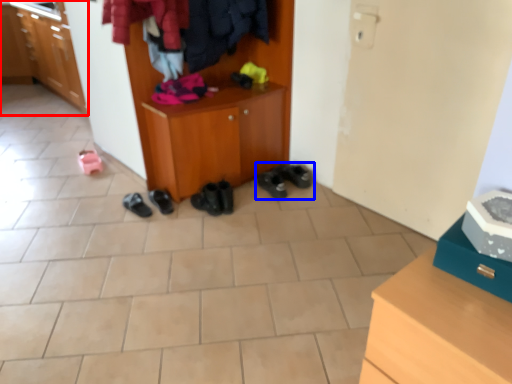
Question: Which object appears farthest to the camera in this image, cabinetry (highlighted by a red box) or footwear (highlighted by a blue box)?

Choices:
 (A) cabinetry
 (B) footwear

Answer: (A)